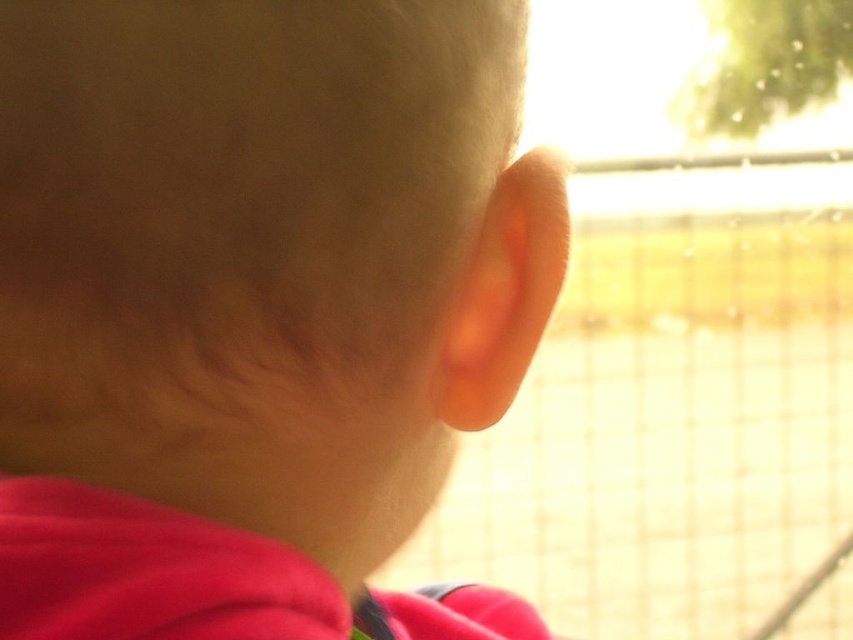
Is smooth skin head at center further to camera compared to transparent glass train window at center?

No, smooth skin head at center is closer to the viewer.

Which of these two, smooth skin head at center or transparent glass train window at center, stands taller?

transparent glass train window at center is taller.

Between point (103, 456) and point (728, 216), which one is positioned behind?

The point (728, 216) is behind.

What are the coordinates of `smooth skin head at center` in the screenshot? It's located at (251, 298).